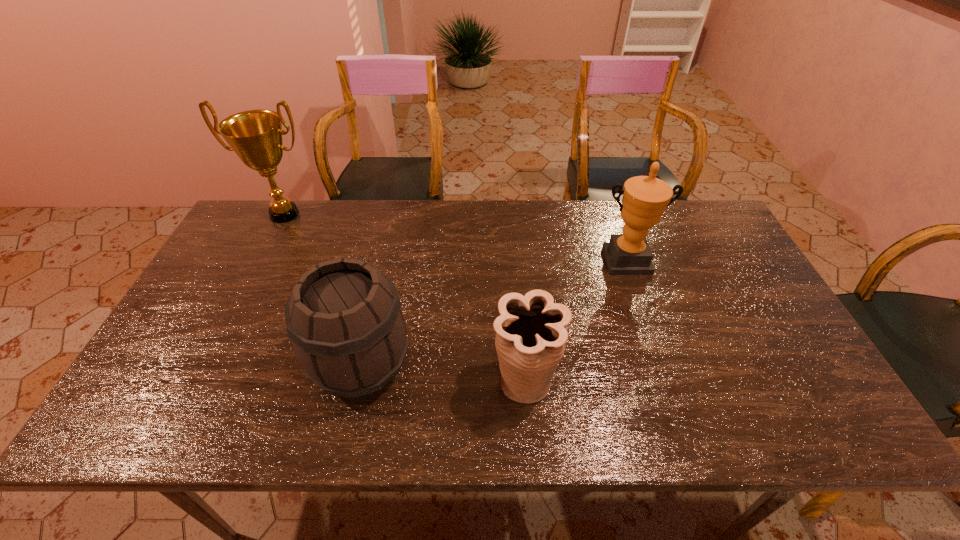
In the image, there is a desktop. Identify the location of free space at the near right corner. click(781, 411).

Image resolution: width=960 pixels, height=540 pixels. Find the location of `empty space that is in between the second object from right to left and the left award`. empty space that is in between the second object from right to left and the left award is located at coordinates (405, 298).

Image resolution: width=960 pixels, height=540 pixels. I want to click on vacant point located between the third nearest object and the shortest object, so click(575, 321).

Identify the location of free space between the shorter award and the urn. (575, 321).

This screenshot has height=540, width=960. Identify the location of vacant area that lies between the second farthest object and the third tallest object. (493, 313).

I want to click on free space between the urn and the nearer award, so click(575, 321).

Identify the location of free point between the third nearest object and the farthest object. Image resolution: width=960 pixels, height=540 pixels. (455, 238).

The image size is (960, 540). Find the location of `vacant area that lies between the third nearest object and the urn`. vacant area that lies between the third nearest object and the urn is located at coordinates (575, 321).

Locate an element on the screen. The width and height of the screenshot is (960, 540). free spot between the shortest object and the right award is located at coordinates (575, 321).

The height and width of the screenshot is (540, 960). I want to click on free space between the wine bucket and the urn, so click(444, 373).